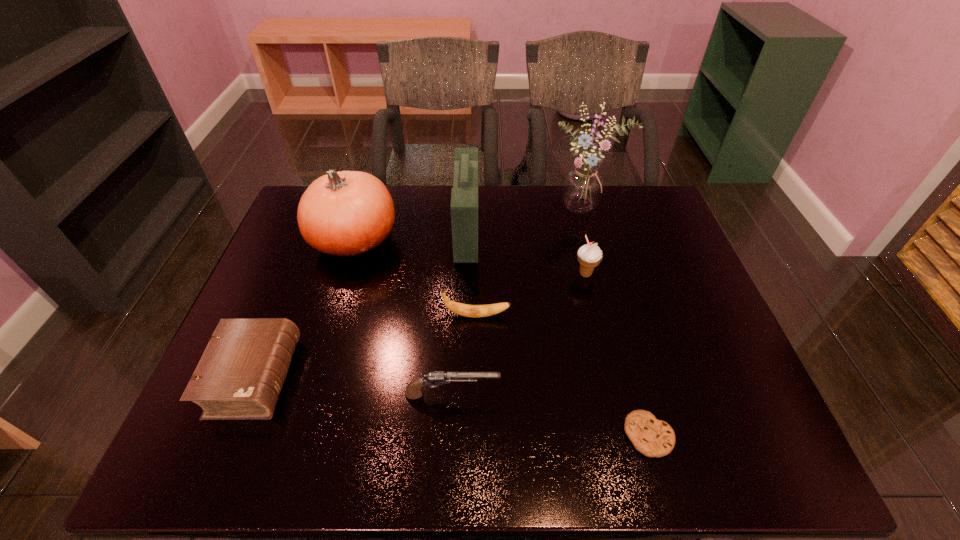
Identify the location of the tallest object. (582, 188).

This screenshot has height=540, width=960. In order to click on pumpkin in this screenshot , I will do `click(348, 213)`.

Where is `the first-aid kit`? the first-aid kit is located at coordinates (464, 197).

The width and height of the screenshot is (960, 540). What are the coordinates of `the fourth tallest object` in the screenshot? It's located at (589, 256).

Identify the location of banana. This screenshot has width=960, height=540. tap(466, 310).

You are a GUI agent. You are given a task and a screenshot of the screen. Output one action in this format:
    pyautogui.click(x=<x>, y=<y>)
    Task: Click on the Bible
    
    Given the screenshot: What is the action you would take?
    pyautogui.click(x=240, y=375)

Where is `gun`? The width and height of the screenshot is (960, 540). gun is located at coordinates (413, 391).

Identify the location of the shortest object. This screenshot has width=960, height=540. (653, 438).

Find the location of a particular element. The height and width of the screenshot is (540, 960). free region located 0.140m on the front-facing side of the bouquet is located at coordinates (597, 253).

Where is `free space located 0.080m on the right of the pumpkin`? This screenshot has width=960, height=540. free space located 0.080m on the right of the pumpkin is located at coordinates (425, 240).